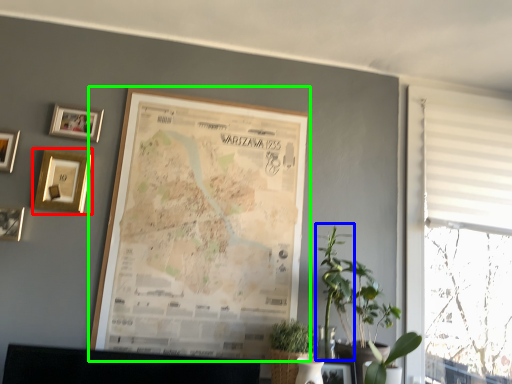
Question: Considering the real-world distances, which object is farthest from picture frame (highlighted by a red box)? plant (highlighted by a blue box) or picture frame (highlighted by a green box)?

Choices:
 (A) plant
 (B) picture frame

Answer: (A)